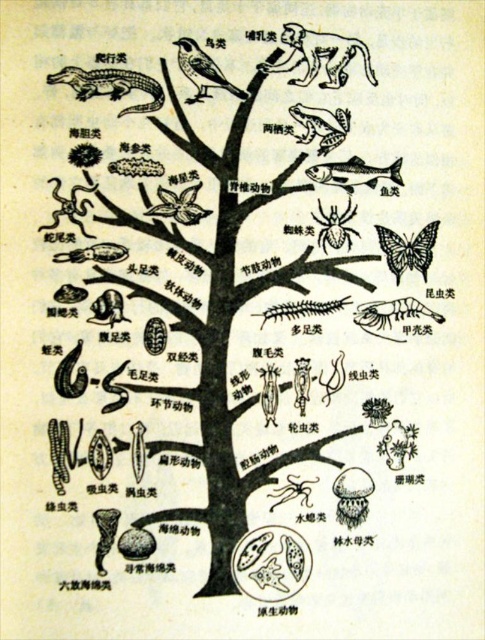
Which is in front, point (283, 40) or point (368, 172)?

Point (283, 40) is in front.

Does brown fur monkey at upper right appear over shiny silver fish at upper right?

Indeed, brown fur monkey at upper right is positioned over shiny silver fish at upper right.

I want to click on brown fur monkey at upper right, so click(x=319, y=56).

How much distance is there between greenish-brown scaly crocodile at upper left and smooth brown bird at center?

greenish-brown scaly crocodile at upper left and smooth brown bird at center are 2.79 inches apart.

Can you confirm if greenish-brown scaly crocodile at upper left is taller than smooth brown bird at center?

Incorrect, greenish-brown scaly crocodile at upper left's height is not larger of smooth brown bird at center's.

I want to click on greenish-brown scaly crocodile at upper left, so click(110, 84).

Can you confirm if brown fur monkey at upper right is positioned above smooth brown bird at center?

Yes.

Is brown fur monkey at upper right behind smooth brown bird at center?

That is True.

Identify the location of brown fur monkey at upper right. (319, 56).